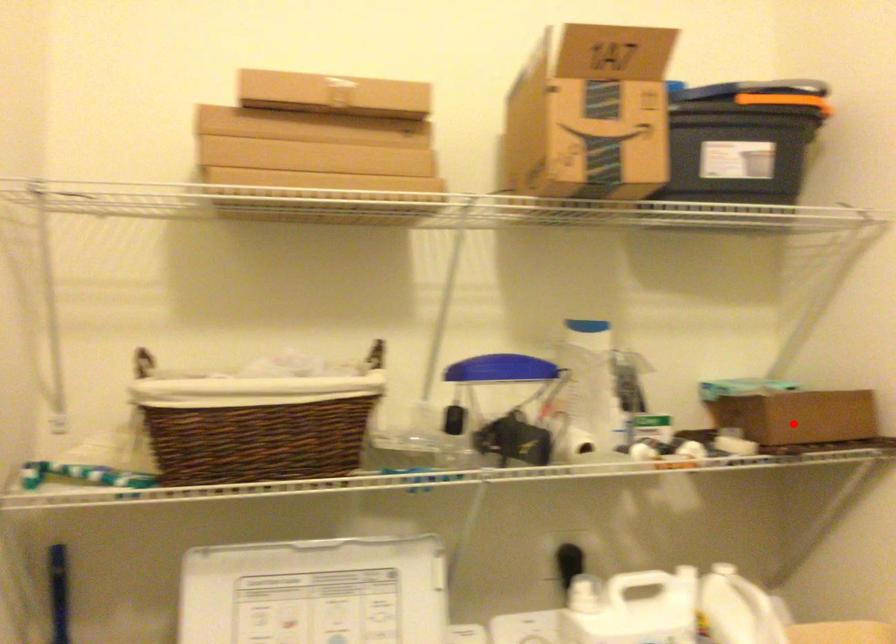
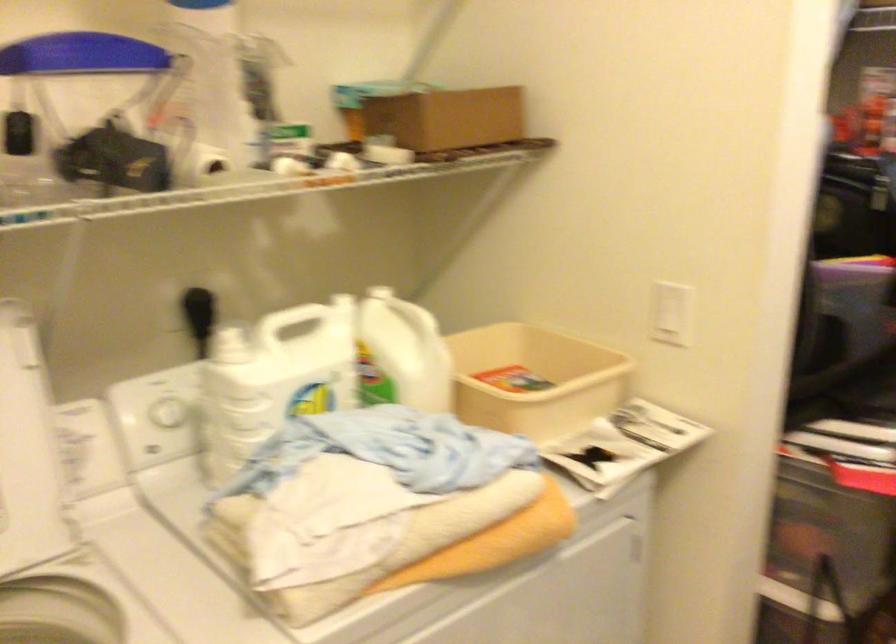
The point at the highlighted location is marked in the first image. Where is the corresponding point in the second image?

(446, 118)